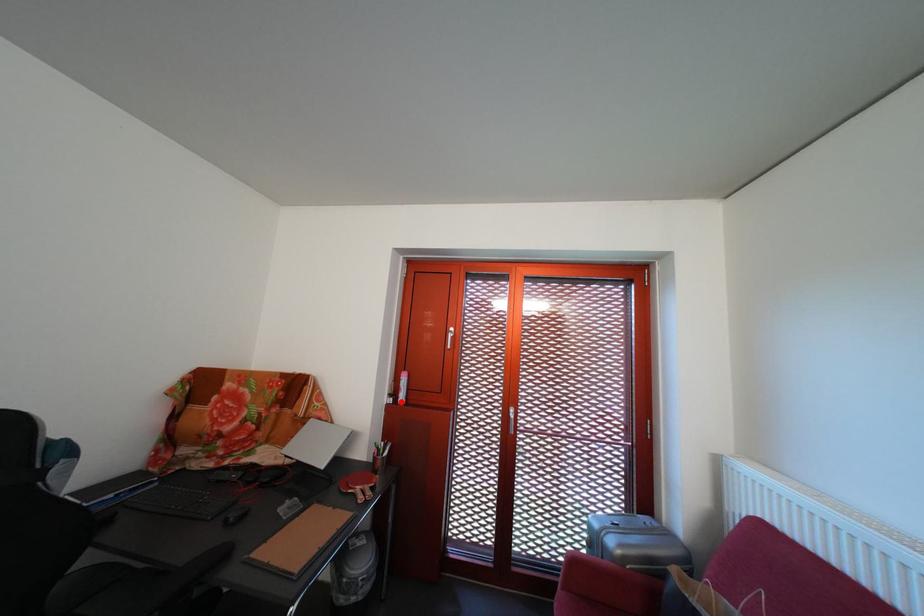
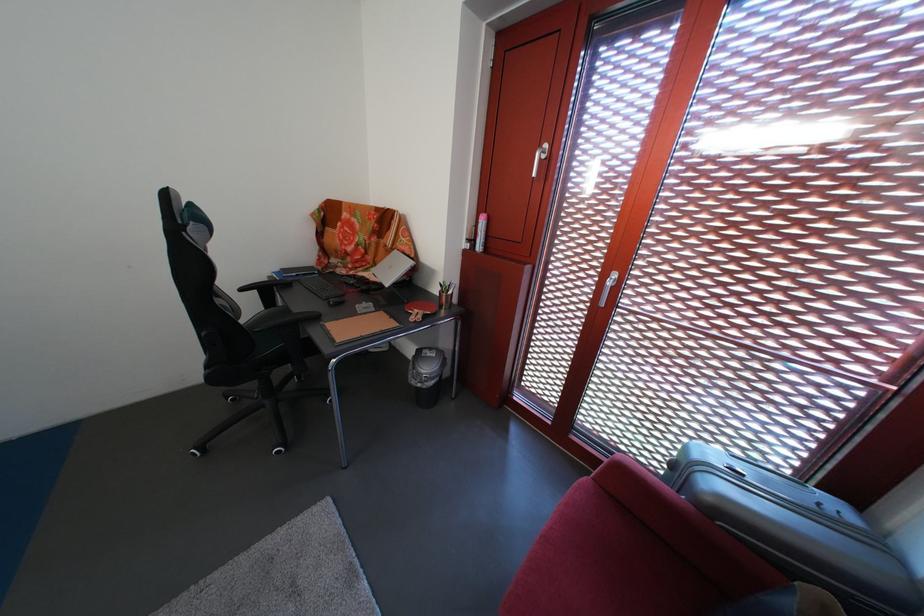
Question: I am providing you with two images of the same scene from different viewpoints. A red point is shown in image1. For the corresponding object point in image2, is it positioned nearer or farther from the camera?

Choices:
 (A) Nearer
 (B) Farther

Answer: (A)